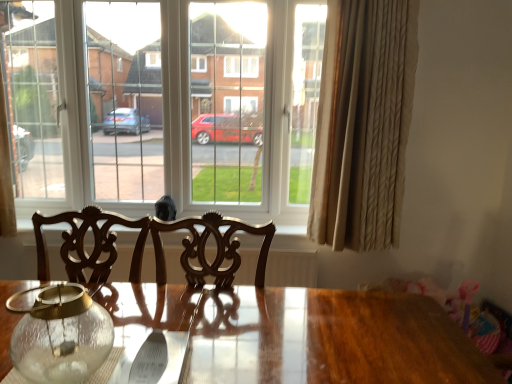
Measure the distance between point (111,126) and camera.

Point (111,126) is 8.05 feet from camera.

What is the approximate width of clear glass window at center?

clear glass window at center is 11.12 inches in width.

What do you see at coordinates (60, 335) in the screenshot? I see `transparent glass jar at lower left` at bounding box center [60, 335].

At what (x,y) coordinates should I click in order to perform the action: click on beige textured curtain at right. Please return your answer as a coordinate pair (x, y). Looking at the image, I should click on (362, 123).

How different are the orientations of clear glass window at center and transparent glass jar at lower left in degrees?

There is a 3.83-degree angle between the facing directions of clear glass window at center and transparent glass jar at lower left.

Is clear glass window at center placed right next to transparent glass jar at lower left?

No.

From a real-world perspective, is clear glass window at center above or below transparent glass jar at lower left?

In terms of real-world spatial position, clear glass window at center is above transparent glass jar at lower left.

Is clear glass window at center in front of or behind transparent glass jar at lower left in the image?

Visually, clear glass window at center is located behind transparent glass jar at lower left.

Is clear glass window at center completely or partially inside transparent glass jar at lower left?

No, clear glass window at center is not surrounded by transparent glass jar at lower left.

From a real-world perspective, which is physically below, transparent glass jar at lower left or clear glass window at center?

transparent glass jar at lower left, from a real-world perspective.

From the image's perspective, between transparent glass jar at lower left and clear glass window at center, which one is located above?

clear glass window at center.

Does transparent glass jar at lower left have a greater height compared to clear glass window at center?

Incorrect, the height of transparent glass jar at lower left is not larger of that of clear glass window at center.

Who is shorter, beige textured curtain at right or transparent glass jar at lower left?

transparent glass jar at lower left.

Can you confirm if beige textured curtain at right is positioned to the right of transparent glass jar at lower left?

Yes.

Locate an element on the screen. glass vase on the left of beige textured curtain at right is located at coordinates (60, 335).

How far apart are beige textured curtain at right and transparent glass jar at lower left?

A distance of 1.43 meters exists between beige textured curtain at right and transparent glass jar at lower left.

Which object is closer to the camera taking this photo, clear glass window at center or beige textured curtain at right?

beige textured curtain at right is in front.

Can you confirm if clear glass window at center is shorter than beige textured curtain at right?

Yes, clear glass window at center is shorter than beige textured curtain at right.

Looking at their sizes, would you say clear glass window at center is wider or thinner than beige textured curtain at right?

In the image, clear glass window at center appears to be wider than beige textured curtain at right.

Is transparent glass jar at lower left not inside beige textured curtain at right?

Yes, transparent glass jar at lower left is not within beige textured curtain at right.

Is beige textured curtain at right at the back of transparent glass jar at lower left?

transparent glass jar at lower left does not have its back to beige textured curtain at right.

From the picture: Does transparent glass jar at lower left have a lesser height compared to beige textured curtain at right?

Yes.

Is beige textured curtain at right oriented away from clear glass window at center?

No, beige textured curtain at right is not facing the opposite direction of clear glass window at center.

Based on the photo, is beige textured curtain at right inside the boundaries of clear glass window at center, or outside?

beige textured curtain at right exists outside the volume of clear glass window at center.

Which is closer to the camera, (401, 58) or (153, 32)?

The point (401, 58) is closer to the camera.

Is beige textured curtain at right beside clear glass window at center?

No.

Find the location of a particular element. This screenshot has height=384, width=512. glass vase located on the right of clear glass window at center is located at coordinates (60, 335).

In the image, there is a transparent glass jar at lower left. At what (x,y) coordinates should I click in order to perform the action: click on window above it (from the image's perspective). Please return your answer as a coordinate pair (x, y). This screenshot has width=512, height=384. Looking at the image, I should click on (219, 109).

Which object lies further to the anchor point transparent glass jar at lower left, beige textured curtain at right or clear glass window at center?

clear glass window at center.

Estimate the real-world distances between objects in this image. Which object is closer to clear glass window at center, beige textured curtain at right or transparent glass jar at lower left?

beige textured curtain at right is positioned closer to the anchor clear glass window at center.

From the image, which object appears to be farther from beige textured curtain at right, clear glass window at center or transparent glass jar at lower left?

transparent glass jar at lower left lies further to beige textured curtain at right than the other object.

Which object lies nearer to the anchor point clear glass window at center, transparent glass jar at lower left or beige textured curtain at right?

beige textured curtain at right.

When comparing their distances from transparent glass jar at lower left, does clear glass window at center or beige textured curtain at right seem closer?

beige textured curtain at right is closer to transparent glass jar at lower left.

Considering their positions, is transparent glass jar at lower left positioned further to beige textured curtain at right than clear glass window at center?

transparent glass jar at lower left lies further to beige textured curtain at right than the other object.

In order to click on glass vase located between clear glass window at center and beige textured curtain at right in the left-right direction in this screenshot , I will do `click(60, 335)`.